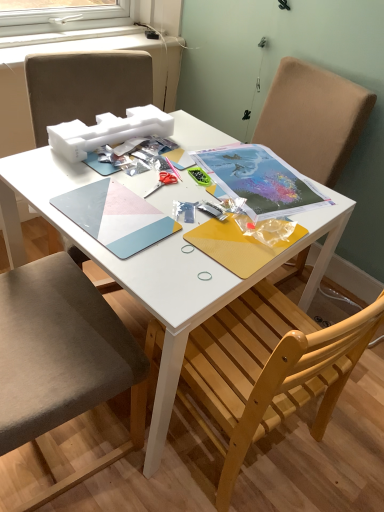
This screenshot has width=384, height=512. What are the coordinates of `free location above matte plastic notebook at center, which ranks as the 1th notebook in left-to-right order (from a real-world perspective)` in the screenshot? It's located at (113, 211).